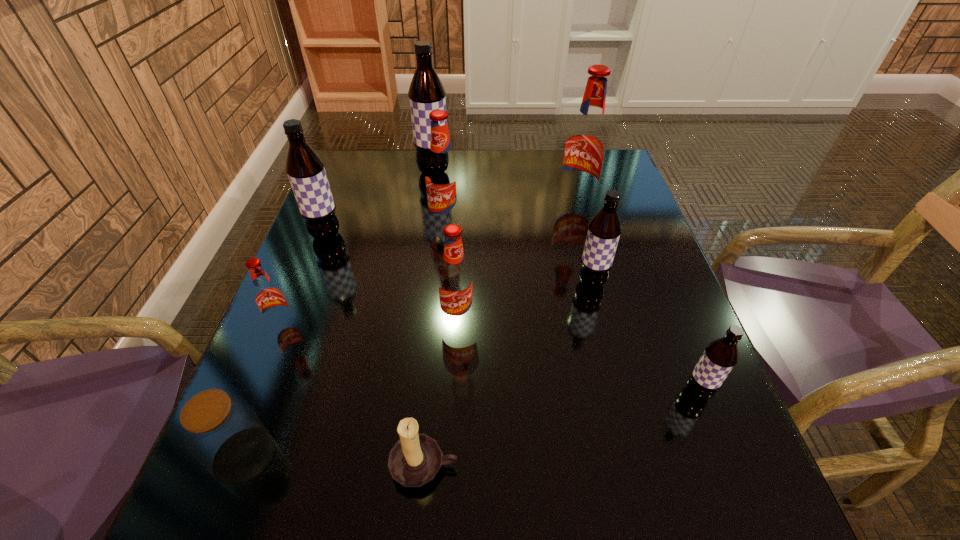
You are a GUI agent. You are given a task and a screenshot of the screen. Output one action in this format:
    pyautogui.click(x=<x>, y=<y>)
    Task: Click on the smallest red root beer
    
    Given the screenshot: What is the action you would take?
    pyautogui.click(x=269, y=297)

In order to click on the rightmost object in this screenshot , I will do `click(720, 356)`.

Where is `the rightmost root beer`? The image size is (960, 540). the rightmost root beer is located at coordinates (720, 356).

Identify the location of brown jar. (220, 430).

The width and height of the screenshot is (960, 540). Find the location of `candle holder`. candle holder is located at coordinates (415, 459).

Image resolution: width=960 pixels, height=540 pixels. What are the coordinates of `vacant space positioned 0.300m on the right of the biggest brown root beer` in the screenshot? It's located at (551, 172).

Identify the location of free location located on the left of the biggest red root beer. (499, 203).

Identify the location of vacant space located on the front of the third smallest red root beer. (437, 328).

Identify the location of vacant area located 0.280m on the right of the leftmost brown root beer. This screenshot has height=540, width=960. (454, 236).

You are a GUI agent. You are given a task and a screenshot of the screen. Output one action in this format:
    pyautogui.click(x=<x>, y=<y>)
    Task: Click on the vacant position located on the back of the third biggest brown root beer
    Image resolution: width=960 pixels, height=540 pixels.
    Given the screenshot: What is the action you would take?
    pyautogui.click(x=572, y=204)